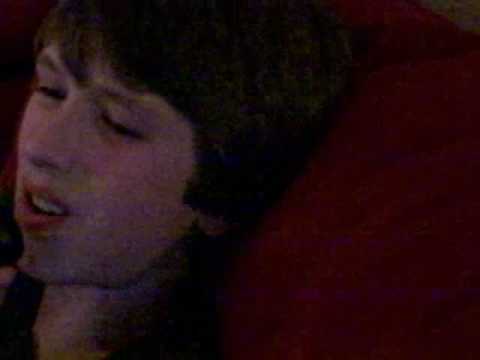
Locate an element on the screen. The width and height of the screenshot is (480, 360). pillow is located at coordinates (389, 271).